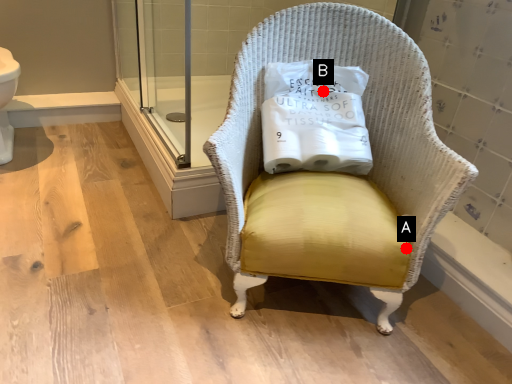
Question: Two points are circled on the image, labeled by A and B beside each circle. Which point is further to the camera?

Choices:
 (A) A is further
 (B) B is further

Answer: (B)